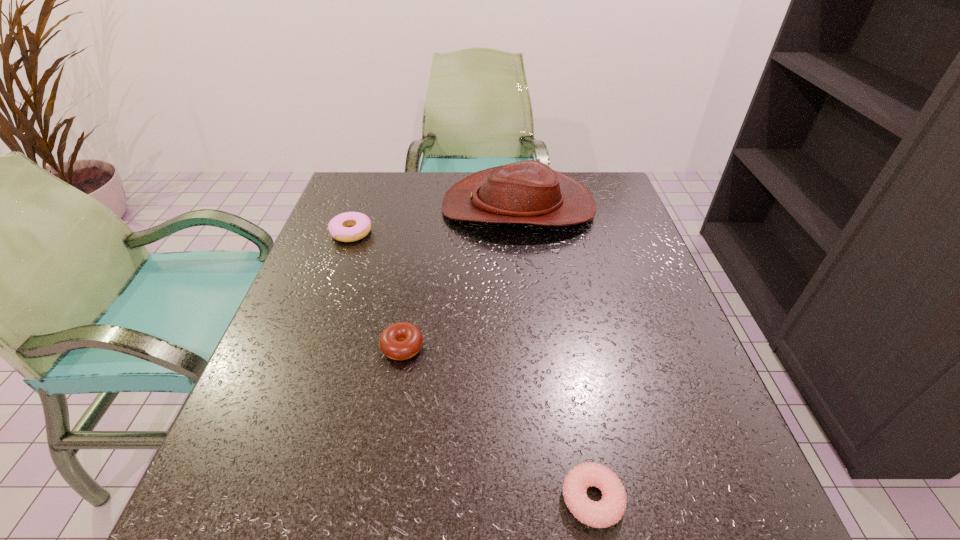
Find the location of `the tallest object`. the tallest object is located at coordinates (528, 192).

Find the location of a particular element. This screenshot has width=960, height=540. the leftmost object is located at coordinates (339, 227).

The image size is (960, 540). I want to click on the farthest doughnut, so click(x=339, y=227).

Locate an element on the screen. This screenshot has height=540, width=960. the third object from right to left is located at coordinates (402, 340).

Identify the location of the second doughnut from right to left. (402, 340).

Where is `the nearest object`? This screenshot has width=960, height=540. the nearest object is located at coordinates (609, 510).

I want to click on the nearest doughnut, so click(x=609, y=510).

In order to click on free point located on the front-facing side of the tallest object in this screenshot , I will do `click(339, 207)`.

Find the location of `vacant space located on the front-facing side of the tallest object`. vacant space located on the front-facing side of the tallest object is located at coordinates (347, 207).

In order to click on vacant region located 0.220m on the front-facing side of the tallest object in this screenshot , I will do `click(361, 207)`.